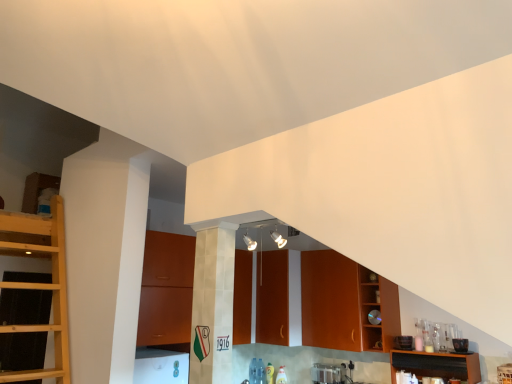
Measure the distance between brown wood cabinet at center, which is counted as the second cabinetry, starting from the right, and camera.

brown wood cabinet at center, which is counted as the second cabinetry, starting from the right, and camera are 3.45 meters apart.

Describe the element at coordinates (437, 365) in the screenshot. I see `brown wooden shelf at lower right` at that location.

Identify the location of brown wood cabinet at center, which is counted as the second cabinetry, starting from the right. The height and width of the screenshot is (384, 512). (345, 304).

In the scene shown: Are matte wood cabinet at center, the 2th cabinetry positioned from the left, and satin silver toaster at lower center located far from each other?

Actually, matte wood cabinet at center, the 2th cabinetry positioned from the left, and satin silver toaster at lower center are a little close together.

Does matte wood cabinet at center, which ranks as the third cabinetry in right-to-left order, have a greater width compared to satin silver toaster at lower center?

Indeed, matte wood cabinet at center, which ranks as the third cabinetry in right-to-left order, has a greater width compared to satin silver toaster at lower center.

Which object is closer to the camera taking this photo, matte wood cabinet at center, which ranks as the third cabinetry in right-to-left order, or satin silver toaster at lower center?

satin silver toaster at lower center is closer to the camera.

Choose the correct answer: Is matte wood cabinet at center, the 2th cabinetry positioned from the left, inside satin silver toaster at lower center or outside it?

The correct answer is: outside.

Is brown wood cabinet at center, which is counted as the second cabinetry, starting from the right, completely or partially inside wooden cabinet at right, the 4th cabinetry positioned from the left?

Definitely not — brown wood cabinet at center, which is counted as the second cabinetry, starting from the right, is not inside wooden cabinet at right, the 4th cabinetry positioned from the left.

The image size is (512, 384). I want to click on cabinetry that is under the brown wood cabinet at center, which is counted as the second cabinetry, starting from the right (from a real-world perspective), so click(x=378, y=310).

Is wooden cabinet at right, acting as the 1th cabinetry starting from the right, behind brown wood cabinet at center, marked as the 3th cabinetry in a left-to-right arrangement?

That is False.

How distant is matte wood cabinet at center, the 2th cabinetry positioned from the left, from brown wood cabinet at center, marked as the 3th cabinetry in a left-to-right arrangement?

The distance of matte wood cabinet at center, the 2th cabinetry positioned from the left, from brown wood cabinet at center, marked as the 3th cabinetry in a left-to-right arrangement, is 17.68 inches.

Considering the points (263, 277) and (348, 322), which point is in front, point (263, 277) or point (348, 322)?

The point (348, 322) is more forward.

In the scene shown: Considering the positions of objects matte wood cabinet at center, which ranks as the third cabinetry in right-to-left order, and brown wood cabinet at center, which is counted as the second cabinetry, starting from the right, in the image provided, who is more to the left, matte wood cabinet at center, which ranks as the third cabinetry in right-to-left order, or brown wood cabinet at center, which is counted as the second cabinetry, starting from the right,?

Positioned to the left is matte wood cabinet at center, which ranks as the third cabinetry in right-to-left order.

Is matte wood cabinetry at center, which ranks as the fourth cabinetry in right-to-left order, facing towards wooden cabinet at right, the 4th cabinetry positioned from the left?

No, matte wood cabinetry at center, which ranks as the fourth cabinetry in right-to-left order, does not turn towards wooden cabinet at right, the 4th cabinetry positioned from the left.

Is matte wood cabinetry at center, which ranks as the fourth cabinetry in right-to-left order, to the left or to the right of wooden cabinet at right, the 4th cabinetry positioned from the left, in the image?

Clearly, matte wood cabinetry at center, which ranks as the fourth cabinetry in right-to-left order, is on the left of wooden cabinet at right, the 4th cabinetry positioned from the left, in the image.

Which object is closer to the camera, matte wood cabinetry at center, which ranks as the fourth cabinetry in right-to-left order, or wooden cabinet at right, the 4th cabinetry positioned from the left?

matte wood cabinetry at center, which ranks as the fourth cabinetry in right-to-left order, is in front.

Between matte wood cabinetry at center, which ranks as the fourth cabinetry in right-to-left order, and wooden cabinet at right, acting as the 1th cabinetry starting from the right, which one has larger size?

matte wood cabinetry at center, which ranks as the fourth cabinetry in right-to-left order, is bigger.

What are the coordinates of `cabinetry that is the 1st object located above the matte wood cabinet at center, the 2th cabinetry positioned from the left (from the image's perspective)` in the screenshot? It's located at click(x=378, y=310).

From the image's perspective, is wooden cabinet at right, acting as the 1th cabinetry starting from the right, under matte wood cabinet at center, which ranks as the third cabinetry in right-to-left order?

No.

Which object is positioned more to the left, wooden cabinet at right, acting as the 1th cabinetry starting from the right, or matte wood cabinet at center, which ranks as the third cabinetry in right-to-left order?

Positioned to the left is matte wood cabinet at center, which ranks as the third cabinetry in right-to-left order.

Which object is further away from the camera, wooden cabinet at right, the 4th cabinetry positioned from the left, or matte wood cabinet at center, the 2th cabinetry positioned from the left?

Positioned behind is matte wood cabinet at center, the 2th cabinetry positioned from the left.

Is matte wood cabinet at center, the 2th cabinetry positioned from the left, thinner than matte wood cabinetry at center, positioned as the first cabinetry in left-to-right order?

Yes.

Is matte wood cabinet at center, the 2th cabinetry positioned from the left, positioned beyond the bounds of matte wood cabinetry at center, which ranks as the fourth cabinetry in right-to-left order?

That's incorrect, matte wood cabinet at center, the 2th cabinetry positioned from the left, is not completely outside matte wood cabinetry at center, which ranks as the fourth cabinetry in right-to-left order.

Is matte wood cabinet at center, the 2th cabinetry positioned from the left, smaller than matte wood cabinetry at center, which ranks as the fourth cabinetry in right-to-left order?

Yes.

Is matte wood cabinet at center, the 2th cabinetry positioned from the left, facing towards matte wood cabinetry at center, positioned as the first cabinetry in left-to-right order?

Yes, matte wood cabinet at center, the 2th cabinetry positioned from the left, faces towards matte wood cabinetry at center, positioned as the first cabinetry in left-to-right order.

How different are the orientations of brown wooden shelf at lower right and brown wood cabinet at center, marked as the 3th cabinetry in a left-to-right arrangement, in degrees?

There is a 0.000373-degree angle between the facing directions of brown wooden shelf at lower right and brown wood cabinet at center, marked as the 3th cabinetry in a left-to-right arrangement.

Which object is closer to the camera, brown wooden shelf at lower right or brown wood cabinet at center, marked as the 3th cabinetry in a left-to-right arrangement?

brown wooden shelf at lower right is closer to the camera.

Which point is more forward, [396,370] or [386,344]?

The point [386,344] is more forward.

From a real-world perspective, who is located lower, brown wooden shelf at lower right or brown wood cabinet at center, which is counted as the second cabinetry, starting from the right?

brown wooden shelf at lower right, from a real-world perspective.

The width and height of the screenshot is (512, 384). I want to click on the 1st cabinetry to the left of the satin silver toaster at lower center, starting your count from the anchor, so click(x=272, y=298).

From a real-world perspective, count 1st cabinetrys upward from the wooden cabinet at right, acting as the 1th cabinetry starting from the right, and point to it. Please provide its 2D coordinates.

[(345, 304)]

Considering their positions, is brown wooden shelf at lower right positioned closer to matte wood cabinet at center, which ranks as the third cabinetry in right-to-left order, than matte wood cabinetry at center, positioned as the first cabinetry in left-to-right order?

matte wood cabinetry at center, positioned as the first cabinetry in left-to-right order, is positioned closer to the anchor matte wood cabinet at center, which ranks as the third cabinetry in right-to-left order.

Which object lies nearer to the anchor point wooden cabinet at right, acting as the 1th cabinetry starting from the right, satin silver toaster at lower center or matte wood cabinet at center, the 2th cabinetry positioned from the left?

satin silver toaster at lower center.

From the picture: Looking at the image, which one is located closer to matte wood cabinet at center, which ranks as the third cabinetry in right-to-left order, matte wood cabinetry at center, positioned as the first cabinetry in left-to-right order, or wooden cabinet at right, acting as the 1th cabinetry starting from the right?

matte wood cabinetry at center, positioned as the first cabinetry in left-to-right order, is closer to matte wood cabinet at center, which ranks as the third cabinetry in right-to-left order.

Based on their spatial positions, is wooden cabinet at right, the 4th cabinetry positioned from the left, or matte wood cabinet at center, the 2th cabinetry positioned from the left, further from brown wooden shelf at lower right?

matte wood cabinet at center, the 2th cabinetry positioned from the left, lies further to brown wooden shelf at lower right than the other object.

Looking at this image, estimate the real-world distances between objects in this image. Which object is closer to brown wooden shelf at lower right, matte wood cabinetry at center, which ranks as the fourth cabinetry in right-to-left order, or satin silver toaster at lower center?

matte wood cabinetry at center, which ranks as the fourth cabinetry in right-to-left order, is closer to brown wooden shelf at lower right.

From the image, which object appears to be nearer to matte wood cabinet at center, which ranks as the third cabinetry in right-to-left order, brown wooden shelf at lower right or wooden cabinet at right, acting as the 1th cabinetry starting from the right?

Among the two, wooden cabinet at right, acting as the 1th cabinetry starting from the right, is located nearer to matte wood cabinet at center, which ranks as the third cabinetry in right-to-left order.

Consider the image. Which object lies nearer to the anchor point brown wooden shelf at lower right, matte wood cabinetry at center, positioned as the first cabinetry in left-to-right order, or wooden cabinet at right, the 4th cabinetry positioned from the left?

wooden cabinet at right, the 4th cabinetry positioned from the left, is closer to brown wooden shelf at lower right.

From the image, which object appears to be nearer to satin silver toaster at lower center, matte wood cabinet at center, which ranks as the third cabinetry in right-to-left order, or brown wooden shelf at lower right?

Among the two, matte wood cabinet at center, which ranks as the third cabinetry in right-to-left order, is located nearer to satin silver toaster at lower center.

You are a GUI agent. You are given a task and a screenshot of the screen. Output one action in this format:
    pyautogui.click(x=<x>, y=<y>)
    Task: Click on the cabinetry situated between brown wood cabinet at center, which is counted as the second cabinetry, starting from the right, and brown wooden shelf at lower right from left to right
    The image size is (512, 384).
    Given the screenshot: What is the action you would take?
    pyautogui.click(x=378, y=310)

Where is `appliance located between matte wood cabinetry at center, which ranks as the fourth cabinetry in right-to-left order, and wooden cabinet at right, the 4th cabinetry positioned from the left, in the left-right direction`? The width and height of the screenshot is (512, 384). appliance located between matte wood cabinetry at center, which ranks as the fourth cabinetry in right-to-left order, and wooden cabinet at right, the 4th cabinetry positioned from the left, in the left-right direction is located at coordinates (328, 373).

You are a GUI agent. You are given a task and a screenshot of the screen. Output one action in this format:
    pyautogui.click(x=<x>, y=<y>)
    Task: Click on the cabinetry between matte wood cabinet at center, which ranks as the third cabinetry in right-to-left order, and wooden cabinet at right, the 4th cabinetry positioned from the left, in the horizontal direction
    
    Given the screenshot: What is the action you would take?
    pyautogui.click(x=345, y=304)

Locate an element on the screen. The height and width of the screenshot is (384, 512). appliance located between matte wood cabinet at center, which ranks as the third cabinetry in right-to-left order, and brown wooden shelf at lower right in the left-right direction is located at coordinates (328, 373).